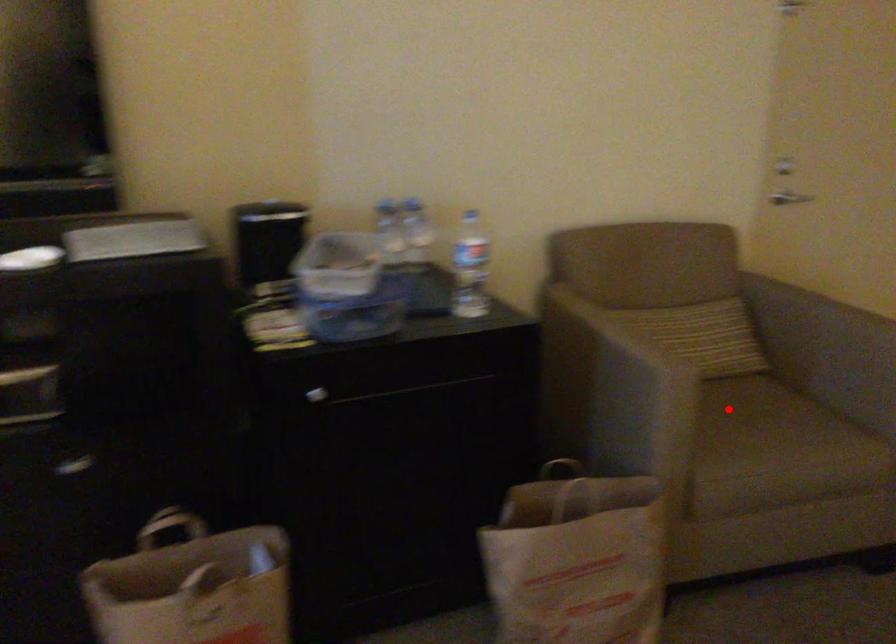
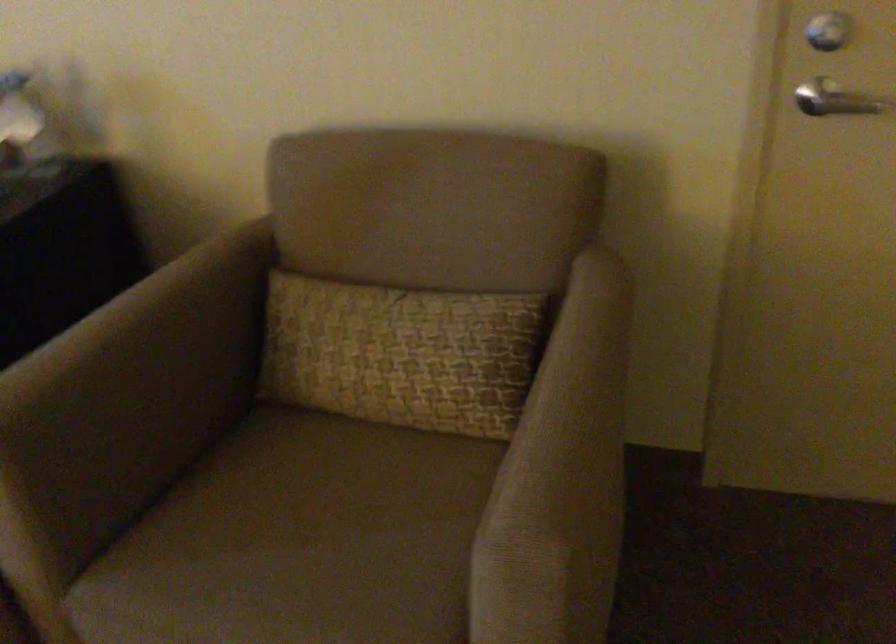
The point at the highlighted location is marked in the first image. Where is the corresponding point in the second image?

(314, 500)